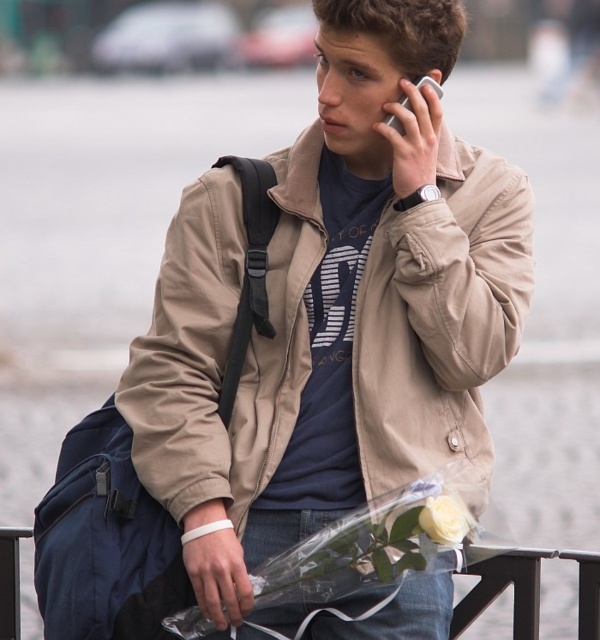
Question: Which of these objects is positioned closest to the clear plastic rail at lower center?

Choices:
 (A) navy blue fabric backpack at lower left
 (B) tan fabric jacket at center
 (C) silver metallic smartphone at upper right

Answer: (B)

Question: Is navy blue fabric backpack at lower left in front of clear plastic rail at lower center?

Choices:
 (A) no
 (B) yes

Answer: (B)

Question: Which of these objects is positioned farthest from the navy blue fabric backpack at lower left?

Choices:
 (A) silver metallic smartphone at upper right
 (B) tan fabric jacket at center

Answer: (A)

Question: Does navy blue fabric backpack at lower left appear over silver metallic smartphone at upper right?

Choices:
 (A) yes
 (B) no

Answer: (B)

Question: Based on their relative distances, which object is farther from the tan fabric jacket at center?

Choices:
 (A) clear plastic rail at lower center
 (B) silver metallic smartphone at upper right
 (C) navy blue fabric backpack at lower left

Answer: (A)

Question: In this image, where is tan fabric jacket at center located relative to silver metallic smartphone at upper right?

Choices:
 (A) right
 (B) left

Answer: (B)